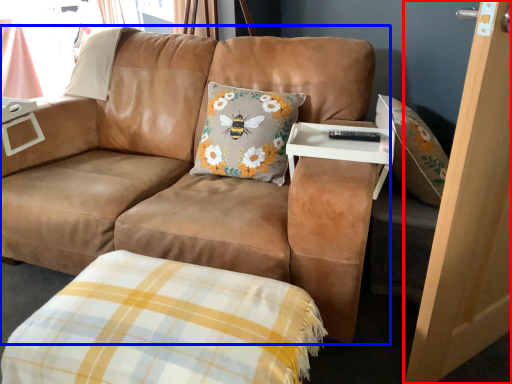
Question: Which object appears closest to the camera in this image, screen door (highlighted by a red box) or studio couch (highlighted by a blue box)?

Choices:
 (A) screen door
 (B) studio couch

Answer: (A)